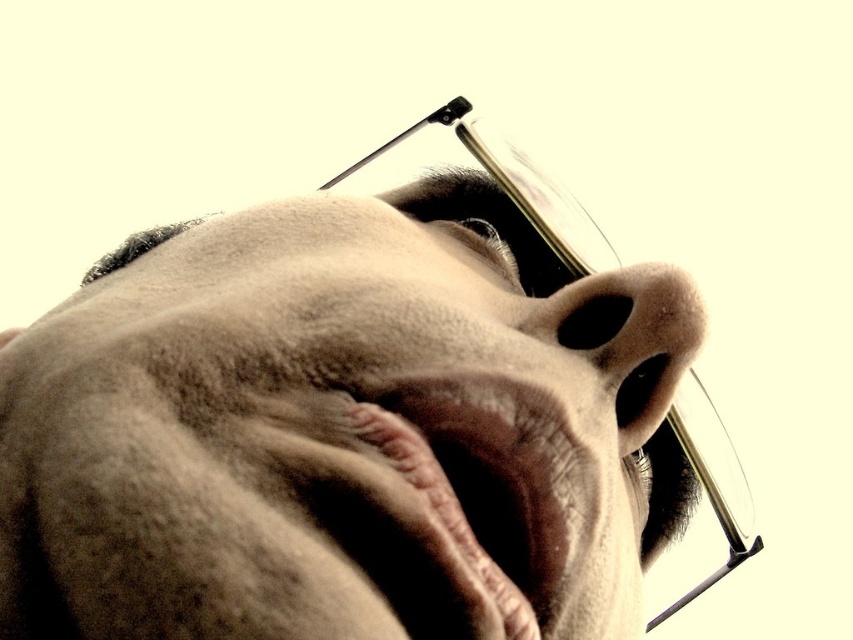
Is point (544, 444) in front of point (631, 291)?

Yes, point (544, 444) is in front of point (631, 291).

Does point (505, 621) come behind point (549, 330)?

No, (505, 621) is in front of (549, 330).

I want to click on dry skin at center, so click(485, 480).

Can you confirm if matte skin face at center is smaller than dry skin at center?

No.

From the picture: Between matte skin face at center and dry skin at center, which one is positioned lower?

dry skin at center is lower down.

Is point (109, 408) positioned behind point (556, 556)?

No, it is in front of (556, 556).

Where is `matte skin face at center`? Image resolution: width=853 pixels, height=640 pixels. matte skin face at center is located at coordinates (343, 432).

The height and width of the screenshot is (640, 853). What are the coordinates of `matte skin face at center` in the screenshot? It's located at (343, 432).

Based on the photo, between matte skin face at center and smooth skin nose at center, which one is positioned higher?

matte skin face at center is above.

Which is in front, point (601, 397) or point (618, 282)?

Point (601, 397)

Identify the location of matte skin face at center. This screenshot has width=853, height=640. (343, 432).